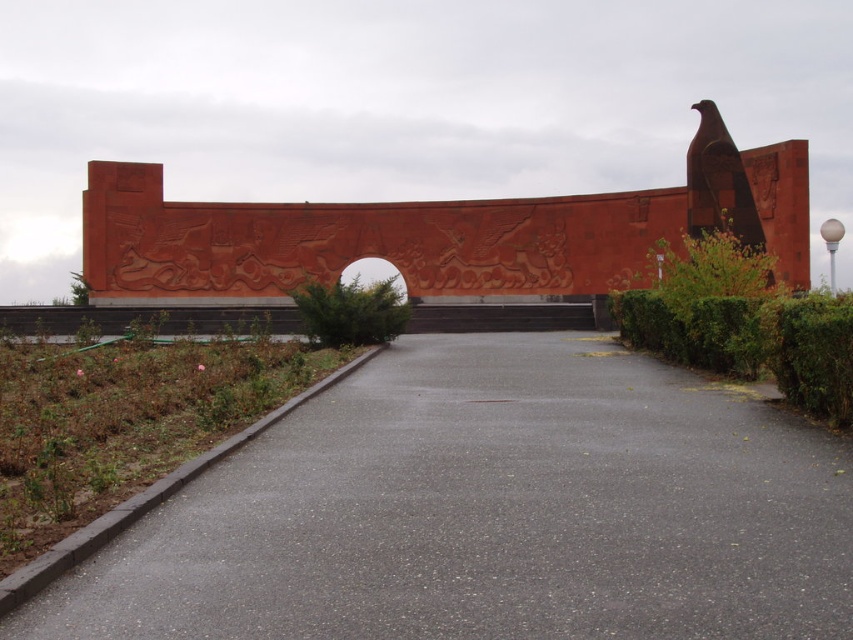
This screenshot has width=853, height=640. Describe the element at coordinates (743, 323) in the screenshot. I see `green leafy hedge at right` at that location.

Does green leafy hedge at right lie in front of green leafy hedge at center?

Yes, green leafy hedge at right is in front of green leafy hedge at center.

Does point (730, 316) come closer to viewer compared to point (358, 316)?

Yes, point (730, 316) is closer to viewer.

Locate an element on the screen. This screenshot has width=853, height=640. green leafy hedge at right is located at coordinates (743, 323).

Between gray asphalt pavement at center and green leafy hedge at right, which one appears on the right side from the viewer's perspective?

green leafy hedge at right

Can you confirm if gray asphalt pavement at center is shorter than green leafy hedge at right?

Yes, gray asphalt pavement at center is shorter than green leafy hedge at right.

Describe the element at coordinates (490, 513) in the screenshot. Image resolution: width=853 pixels, height=640 pixels. I see `gray asphalt pavement at center` at that location.

Locate an element on the screen. The width and height of the screenshot is (853, 640). gray asphalt pavement at center is located at coordinates (490, 513).

Can you confirm if gray asphalt pavement at center is positioned to the left of green leafy hedge at center?

No, gray asphalt pavement at center is not to the left of green leafy hedge at center.

Is gray asphalt pavement at center bigger than green leafy hedge at center?

Incorrect, gray asphalt pavement at center is not larger than green leafy hedge at center.

Where is `gray asphalt pavement at center`? The width and height of the screenshot is (853, 640). gray asphalt pavement at center is located at coordinates (490, 513).